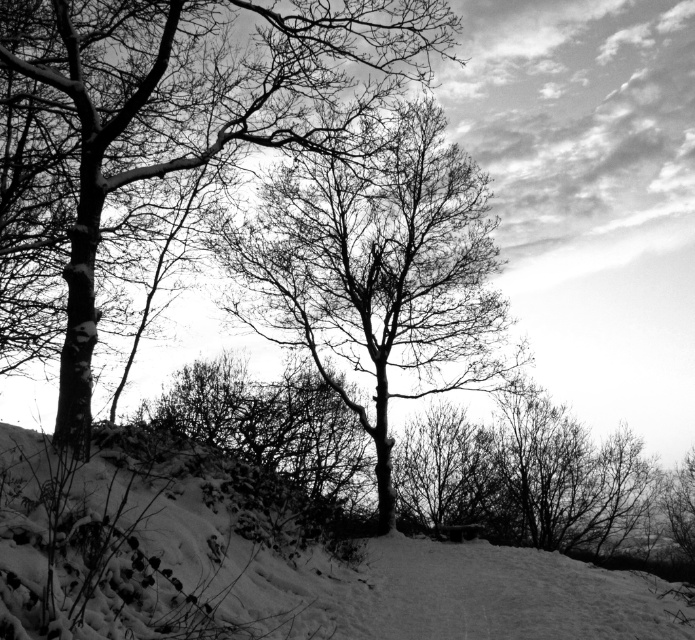
Which is above, snowy white hillside at lower left or bare branches at center?

Positioned higher is bare branches at center.

Who is more forward, (13, 429) or (318, 189)?

Point (13, 429) is in front.

Between point (357, 632) and point (343, 323), which one is positioned behind?

Positioned behind is point (343, 323).

Image resolution: width=695 pixels, height=640 pixels. Find the location of `snowy white hillside at lower left`. snowy white hillside at lower left is located at coordinates (281, 570).

Does point (400, 259) come behind point (65, 20)?

Yes, point (400, 259) is behind point (65, 20).

Looking at this image, can you confirm if bare branches at center is shorter than snow-covered branches at upper center?

Yes, bare branches at center is shorter than snow-covered branches at upper center.

Where is `bare branches at center`? Image resolution: width=695 pixels, height=640 pixels. bare branches at center is located at coordinates (377, 272).

Between point (40, 518) and point (165, 38), which one is positioned in front?

Point (40, 518) is more forward.

Does point (459, 566) come in front of point (202, 118)?

Yes, point (459, 566) is closer to viewer.

What do you see at coordinates (281, 570) in the screenshot? Image resolution: width=695 pixels, height=640 pixels. I see `snowy white hillside at lower left` at bounding box center [281, 570].

This screenshot has width=695, height=640. I want to click on snowy white hillside at lower left, so click(x=281, y=570).